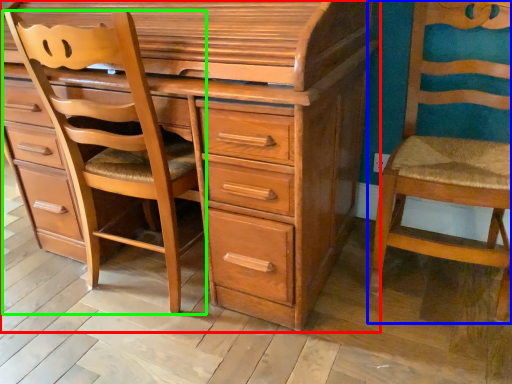
Question: Considering the real-world distances, which object is closest to chest of drawers (highlighted by a red box)? chair (highlighted by a blue box) or furniture (highlighted by a green box).

Choices:
 (A) chair
 (B) furniture

Answer: (B)